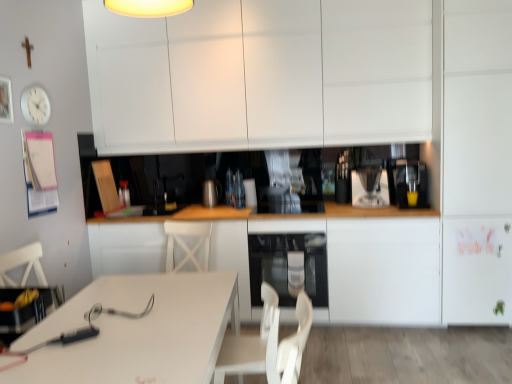
Question: Is white glossy table at lower left positioned far away from white plastic swivel chair at lower center?

Choices:
 (A) no
 (B) yes

Answer: (A)

Question: Is white glossy table at lower left positioned before white plastic swivel chair at lower center?

Choices:
 (A) no
 (B) yes

Answer: (B)

Question: Considering the relative sizes of white glossy table at lower left and white plastic swivel chair at lower center in the image provided, is white glossy table at lower left smaller than white plastic swivel chair at lower center?

Choices:
 (A) no
 (B) yes

Answer: (A)

Question: Is white glossy table at lower left looking in the opposite direction of white plastic swivel chair at lower center?

Choices:
 (A) yes
 (B) no

Answer: (A)

Question: Does white glossy table at lower left have a lesser width compared to white plastic swivel chair at lower center?

Choices:
 (A) yes
 (B) no

Answer: (B)

Question: Is white glossy table at lower left touching white plastic swivel chair at lower center?

Choices:
 (A) no
 (B) yes

Answer: (A)

Question: From the image's perspective, does satin silver kettle at center, which ranks as the 2th appliance in right-to-left order, appear higher than white plastic swivel chair at lower center?

Choices:
 (A) yes
 (B) no

Answer: (A)

Question: Does satin silver kettle at center, the first appliance in the left-to-right sequence, have a lesser width compared to white plastic swivel chair at lower center?

Choices:
 (A) yes
 (B) no

Answer: (A)

Question: Is satin silver kettle at center, the 1th appliance when ordered from back to front, positioned before white plastic swivel chair at lower center?

Choices:
 (A) yes
 (B) no

Answer: (B)

Question: From a real-world perspective, is satin silver kettle at center, which ranks as the 2th appliance in right-to-left order, below white plastic swivel chair at lower center?

Choices:
 (A) no
 (B) yes

Answer: (A)

Question: Is satin silver kettle at center, the first appliance in the left-to-right sequence, positioned behind white plastic swivel chair at lower center?

Choices:
 (A) yes
 (B) no

Answer: (A)

Question: Is satin silver kettle at center, which ranks as the 2th appliance in right-to-left order, facing towards white plastic swivel chair at lower center?

Choices:
 (A) no
 (B) yes

Answer: (B)

Question: From a real-world perspective, is satin black oven at lower center positioned under white glossy table at lower left based on gravity?

Choices:
 (A) no
 (B) yes

Answer: (A)